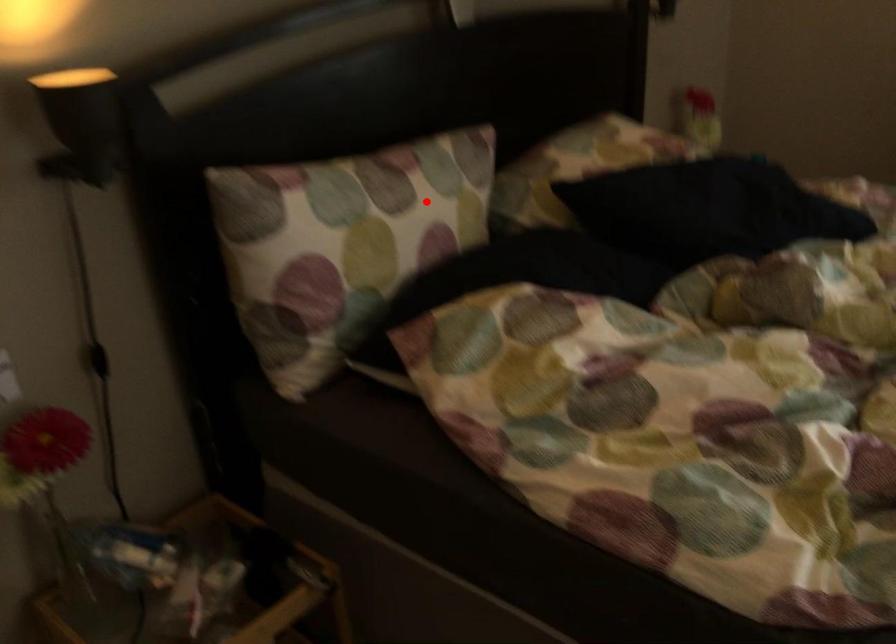
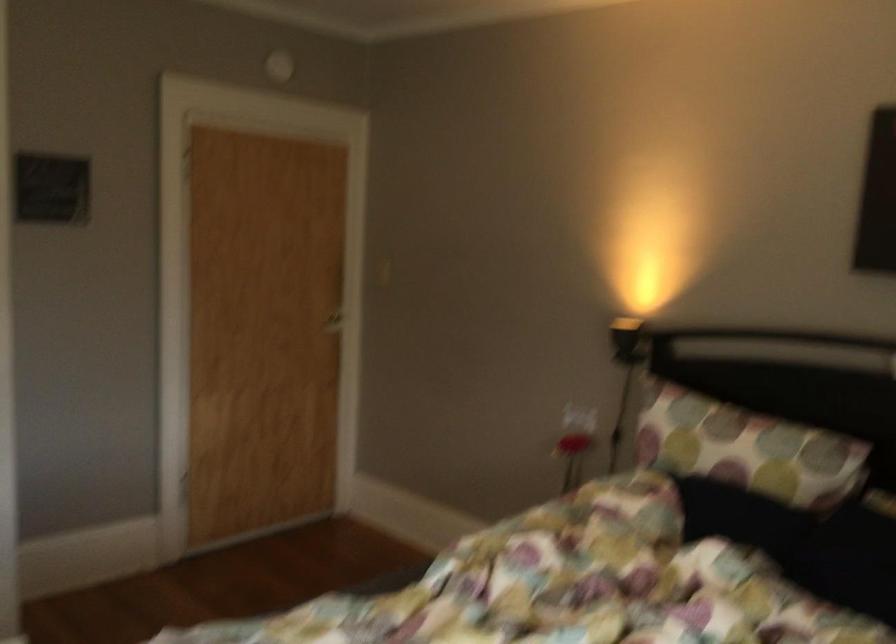
The point at the highlighted location is marked in the first image. Where is the corresponding point in the second image?

(746, 449)